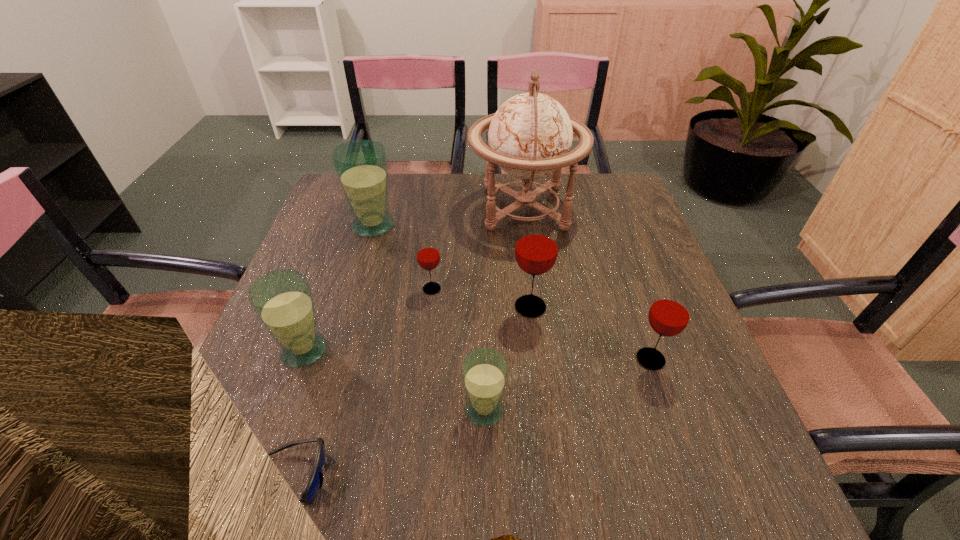
Identify which glass is the third nearest to the second smallest blue glass. Please provide its 2D coordinates. Your answer should be formatted as a tuple, i.e. [(x, y)], where the tuple contains the x and y coordinates of a point satisfying the conditions above.

[(361, 166)]

Find the location of a particular element. The image size is (960, 540). blue glass that can be found as the closest to the farthest blue glass is located at coordinates (282, 299).

This screenshot has height=540, width=960. Find the location of `blue glass that can be found as the closest to the second nearest blue glass`. blue glass that can be found as the closest to the second nearest blue glass is located at coordinates (484, 372).

What are the coordinates of `red glass that can be found as the closest to the globe` in the screenshot? It's located at 428,255.

Choose which red glass is the nearest neighbor to the second glass from right to left. Please provide its 2D coordinates. Your answer should be formatted as a tuple, i.e. [(x, y)], where the tuple contains the x and y coordinates of a point satisfying the conditions above.

[(428, 255)]

Locate an element on the screen. The image size is (960, 540). vacant point that satisfies the following two spatial constraints: 1. on the front side of the second biggest red glass; 2. on the front-facing side of the nearest object is located at coordinates (691, 477).

Locate an element on the screen. This screenshot has height=540, width=960. vacant position in the image that satisfies the following two spatial constraints: 1. on the front side of the nearest red glass; 2. on the left side of the farthest blue glass is located at coordinates (334, 360).

At what (x,y) coordinates should I click in order to perform the action: click on free spot that satisfies the following two spatial constraints: 1. on the front side of the rightmost red glass; 2. on the left side of the smallest red glass. Please return your answer as a coordinate pair (x, y). The width and height of the screenshot is (960, 540). Looking at the image, I should click on (423, 360).